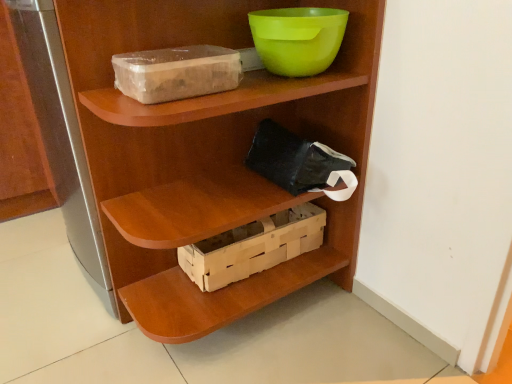
Question: Does wooden crate at center appear on the right side of wooden shelf at center?

Choices:
 (A) no
 (B) yes

Answer: (B)

Question: Does wooden crate at center have a smaller size compared to wooden shelf at center?

Choices:
 (A) no
 (B) yes

Answer: (B)

Question: From the image's perspective, is wooden crate at center above wooden shelf at center?

Choices:
 (A) no
 (B) yes

Answer: (A)

Question: Considering the relative sizes of wooden crate at center and wooden shelf at center in the image provided, is wooden crate at center thinner than wooden shelf at center?

Choices:
 (A) yes
 (B) no

Answer: (A)

Question: Is wooden crate at center taller than wooden shelf at center?

Choices:
 (A) yes
 (B) no

Answer: (B)

Question: Considering the positions of wooden crate at center and green plastic bowl at upper center in the image, is wooden crate at center bigger or smaller than green plastic bowl at upper center?

Choices:
 (A) big
 (B) small

Answer: (A)

Question: Is point (245, 259) closer or farther from the camera than point (262, 36)?

Choices:
 (A) farther
 (B) closer

Answer: (A)

Question: In terms of width, does wooden crate at center look wider or thinner when compared to green plastic bowl at upper center?

Choices:
 (A) wide
 (B) thin

Answer: (B)

Question: In terms of height, does wooden crate at center look taller or shorter compared to green plastic bowl at upper center?

Choices:
 (A) short
 (B) tall

Answer: (B)

Question: From a real-world perspective, is wooden shelf at center positioned above or below wooden crate at center?

Choices:
 (A) below
 (B) above

Answer: (B)

Question: Is wooden shelf at center spatially inside wooden crate at center, or outside of it?

Choices:
 (A) outside
 (B) inside

Answer: (A)

Question: Is wooden shelf at center taller or shorter than wooden crate at center?

Choices:
 (A) short
 (B) tall

Answer: (B)

Question: Is wooden shelf at center wider or thinner than wooden crate at center?

Choices:
 (A) wide
 (B) thin

Answer: (A)

Question: Choose the correct answer: Is transparent plastic storage box at upper left inside green plastic bowl at upper center or outside it?

Choices:
 (A) inside
 (B) outside

Answer: (B)

Question: Is transparent plastic storage box at upper left in front of or behind green plastic bowl at upper center in the image?

Choices:
 (A) front
 (B) behind

Answer: (A)